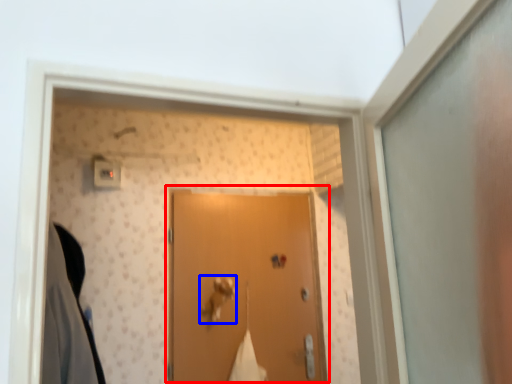
Question: Which object is closer to the camera taking this photo, door (highlighted by a red box) or door handle (highlighted by a blue box)?

Choices:
 (A) door
 (B) door handle

Answer: (A)